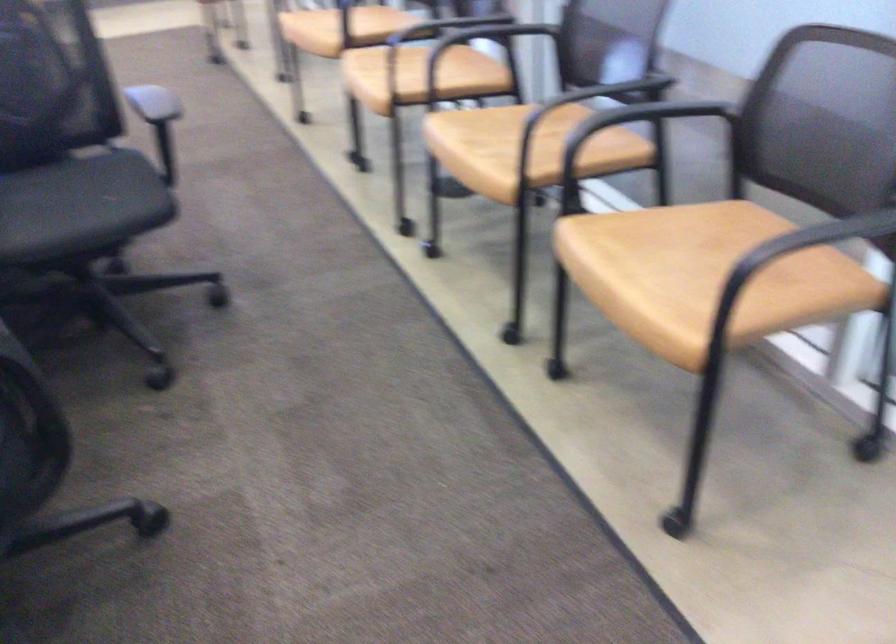
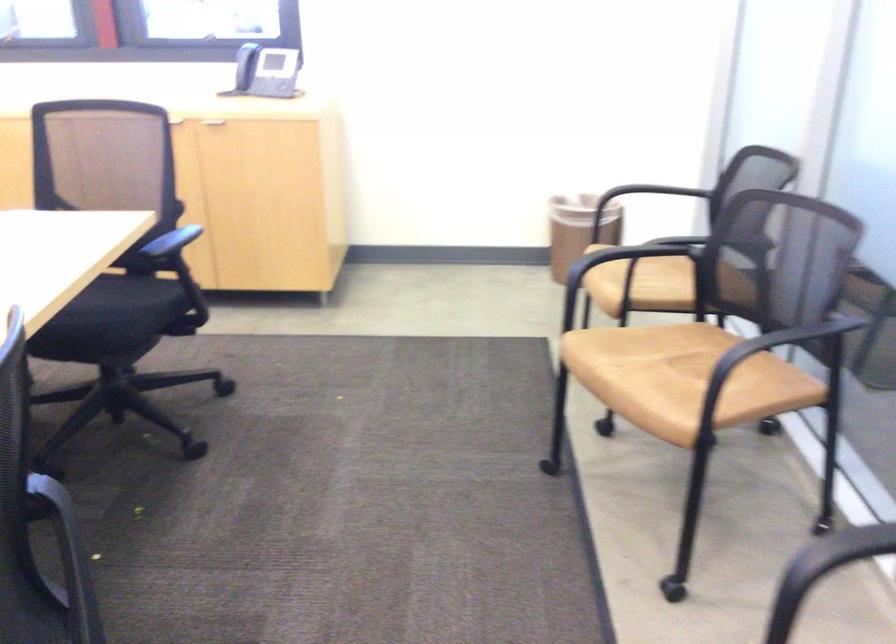
Which direction would the cameraman need to move to produce the second image?

The cameraman moved toward left, forward.